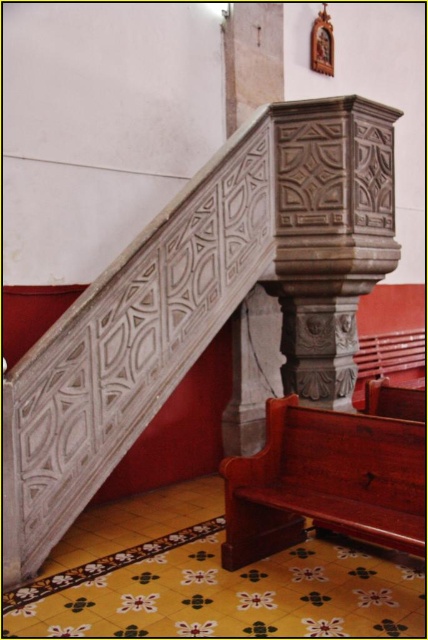
Based on the photo, you are standing at the base of the white stone staircase at upper left and want to take a photo of the intricate stone balustrade. The camera you are using has a maximum focus range of 3 meters. Can you capture the entire balustrade in one shot without moving the camera?

The white stone staircase at upper left and camera are 3.02 meters apart from each other. Since the maximum focus range is 3 meters, the distance is slightly beyond the camera can focus, so you cannot capture the entire balustrade in one shot without moving the camera.

You are standing at the base of the white stone staircase at upper left and want to reach the mahogany wood church bench at lower right. Which direction should you move to get there?

You should move downward from the white stone staircase at upper left to reach the mahogany wood church bench at lower right since it is located below the staircase.

You are standing at the point marked as point (201, 304) in the image. What object is located at this specific coordinate?

The white stone staircase at upper left is located at point (201, 304).